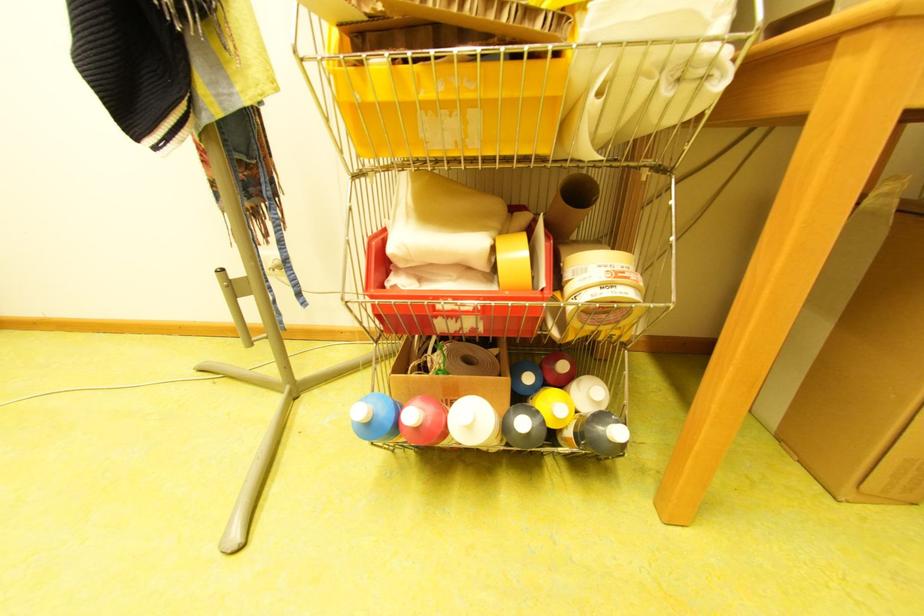
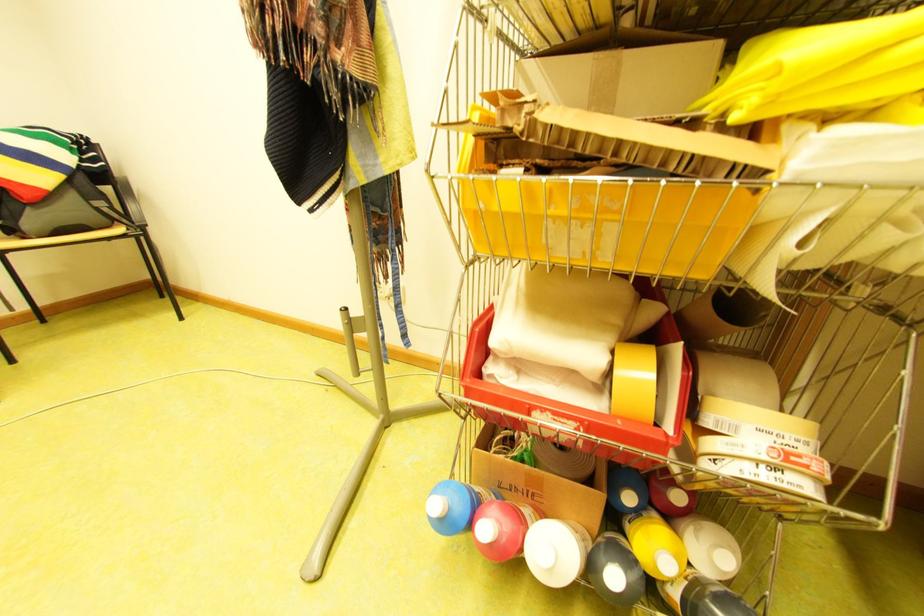
Locate, in the second image, the point that corresponds to point (467, 300) in the first image.

(565, 414)